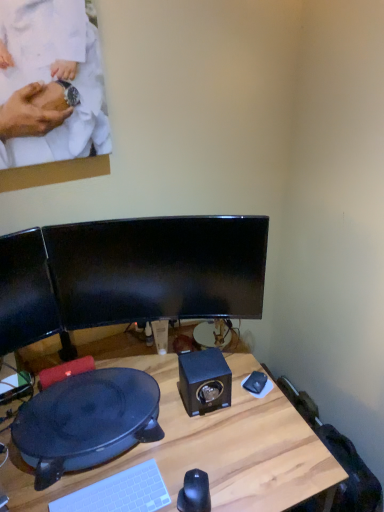
Find the location of a particular element. Image resolution: width=384 pixels, height=512 pixels. vacant area that lies between black matte speaker at center and black plastic wok at lower left is located at coordinates (175, 398).